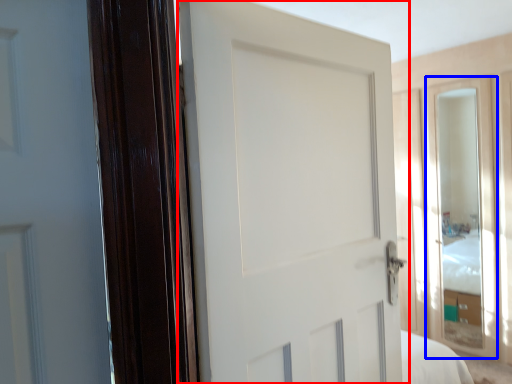
Question: Which of the following is the farthest to the observer, door (highlighted by a red box) or glass door (highlighted by a blue box)?

Choices:
 (A) door
 (B) glass door

Answer: (B)